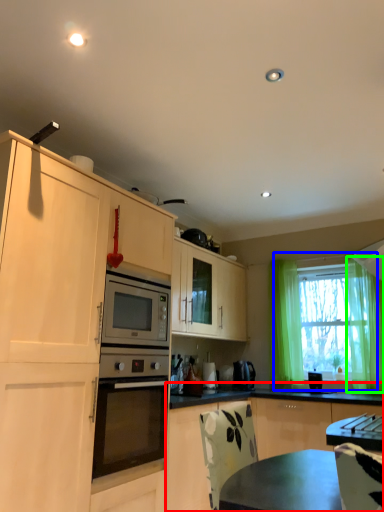
Question: Which object is positioned closest to cabinetry (highlighted by a red box)? Select from window (highlighted by a blue box) and curtain (highlighted by a green box).

Choices:
 (A) window
 (B) curtain

Answer: (A)